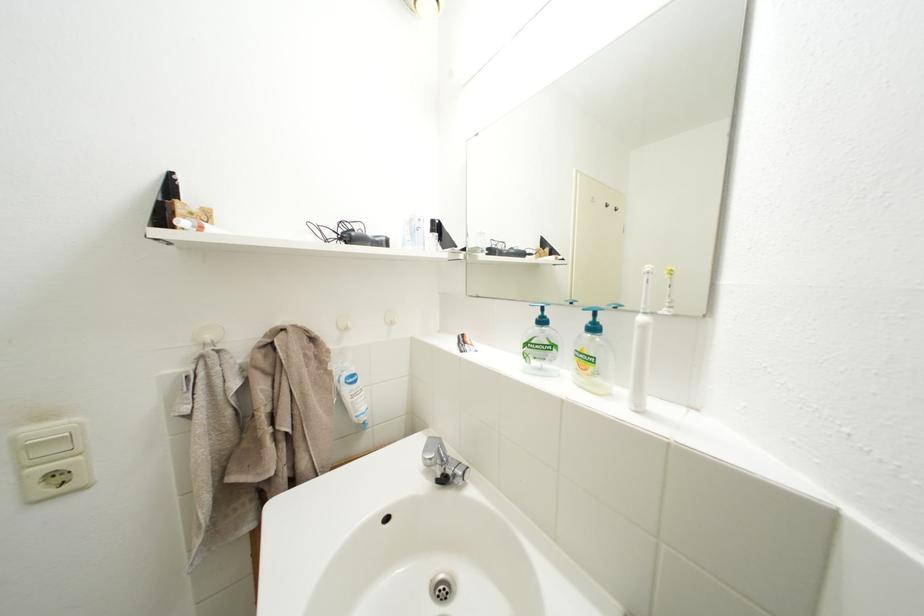
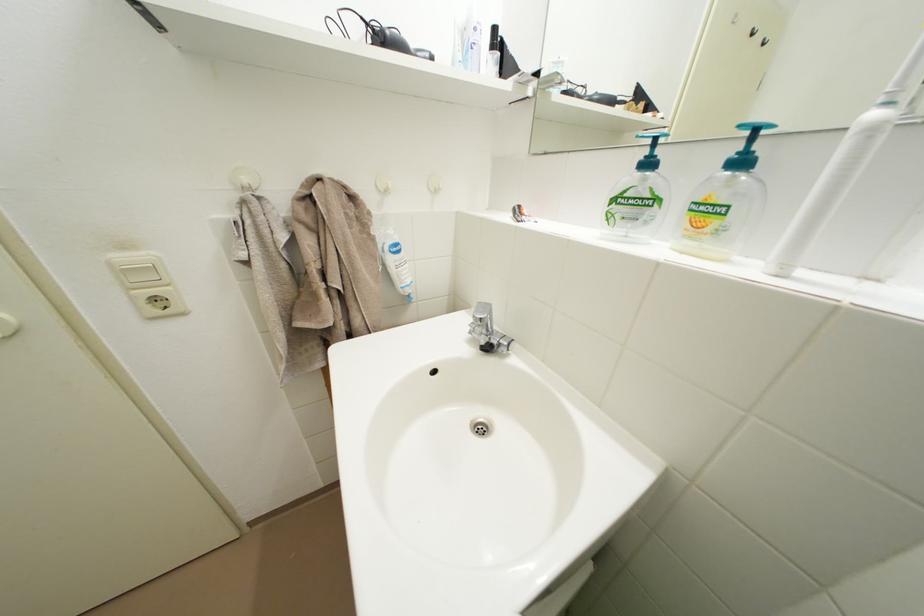
Question: Based on the continuous images, in which direction is the camera rotating? Reply with the corresponding letter.

Choices:
 (A) Left
 (B) Right
 (C) Up
 (D) Down

Answer: (D)